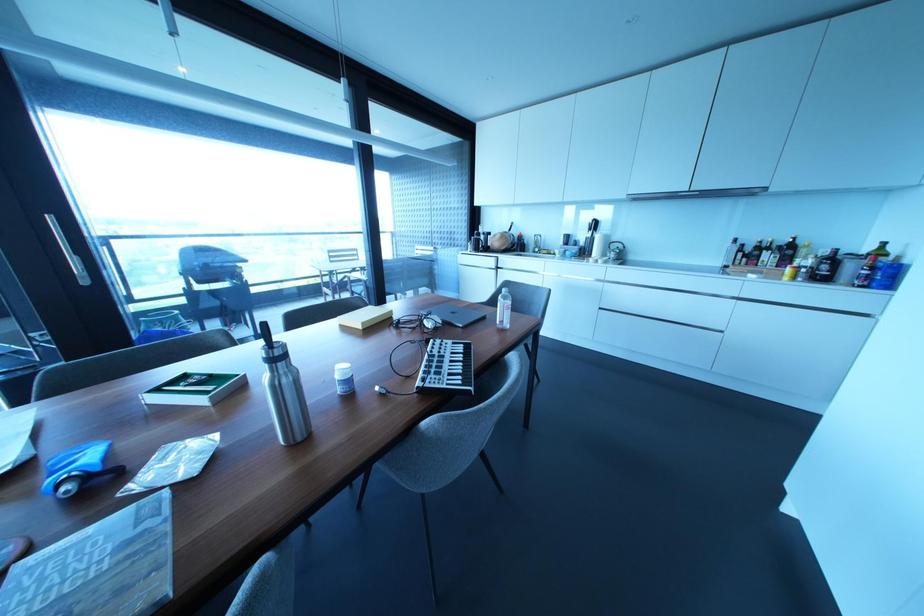
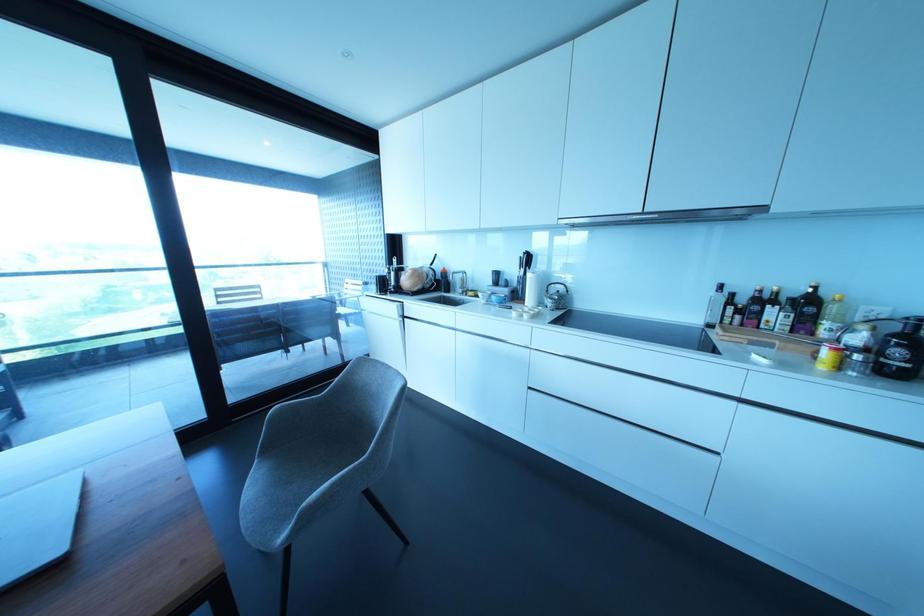
Find the pixel in the second image that matches the point at 805,270 in the first image.

(857, 357)